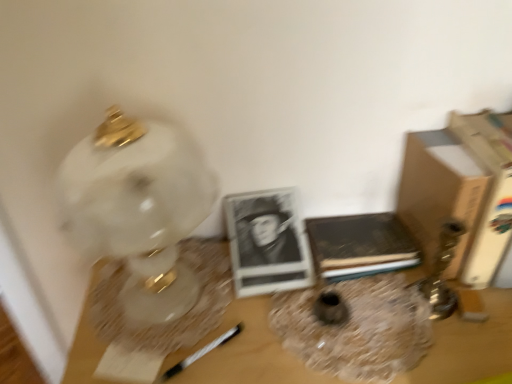
Question: Considering the positions of wooden table at center and brown cardboard book at right, which is the 1th paperback book from right to left, in the image, is wooden table at center taller or shorter than brown cardboard book at right, which is the 1th paperback book from right to left,?

Choices:
 (A) tall
 (B) short

Answer: (A)

Question: Looking at their shapes, would you say wooden table at center is wider or thinner than brown cardboard book at right, the 2th paperback book from the left?

Choices:
 (A) thin
 (B) wide

Answer: (B)

Question: Estimate the real-world distances between objects in this image. Which object is farther from the wooden table at center?

Choices:
 (A) matte glass vase at center, which ranks as the 1th vase in left-to-right order
 (B) brown leather book at center, which ranks as the 1th paperback book in left-to-right order
 (C) brown cardboard book at right, the 2th paperback book from the left
 (D) translucent glass vase at center, which is counted as the first vase, starting from the right
 (E) white marble lamp at left

Answer: (C)

Question: Which of these objects is positioned farthest from the brown cardboard box at right?

Choices:
 (A) brown leather book at center, which ranks as the 1th paperback book in left-to-right order
 (B) matte glass vase at center, which ranks as the 1th vase in left-to-right order
 (C) translucent glass vase at center, which is counted as the first vase, starting from the right
 (D) wooden table at center
 (E) brown cardboard book at right, which is the 1th paperback book from right to left

Answer: (B)